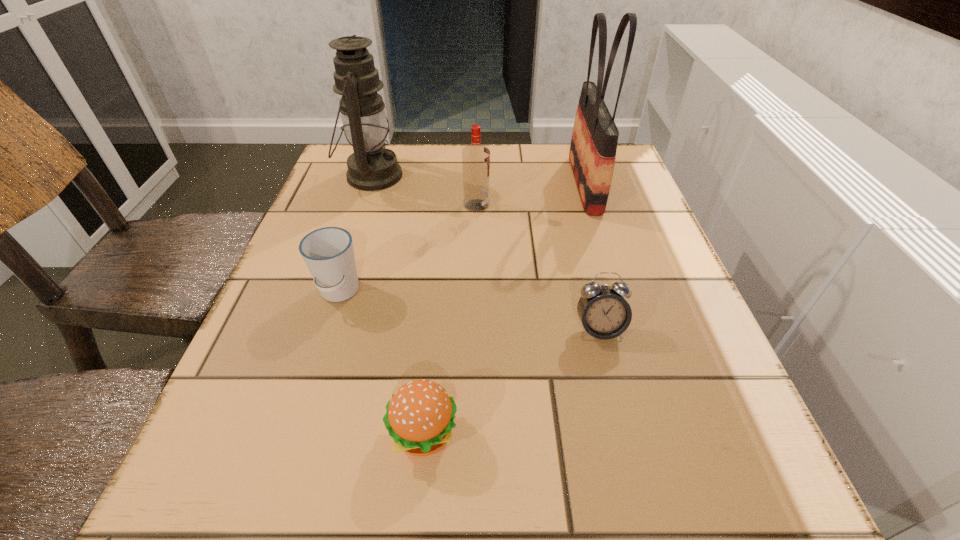
Locate an element on the screen. The image size is (960, 540). vacant space located 0.110m on the front of the oil lamp is located at coordinates (354, 229).

Find the location of a particular element. This screenshot has height=540, width=960. free space located 0.290m on the front label of the vodka is located at coordinates (615, 206).

Image resolution: width=960 pixels, height=540 pixels. I want to click on vacant space located with a handle on the side of the third nearest object, so click(x=301, y=411).

You are a GUI agent. You are given a task and a screenshot of the screen. Output one action in this format:
    pyautogui.click(x=<x>, y=<y>)
    Task: Click on the free space located 0.180m on the face of the fifth farthest object
    This screenshot has width=960, height=540.
    Given the screenshot: What is the action you would take?
    pyautogui.click(x=629, y=451)

Locate an element on the screen. This screenshot has height=540, width=960. free space located 0.210m on the back of the shortest object is located at coordinates (437, 299).

Locate an element on the screen. The height and width of the screenshot is (540, 960). shopping bag at the far edge is located at coordinates (593, 147).

Where is `oil lamp that is at the far edge`? This screenshot has width=960, height=540. oil lamp that is at the far edge is located at coordinates (372, 167).

Locate an element on the screen. object present at the near edge is located at coordinates (419, 417).

Where is `oil lamp at the left edge`? This screenshot has height=540, width=960. oil lamp at the left edge is located at coordinates (372, 167).

Where is `cup positioned at the left edge`? The width and height of the screenshot is (960, 540). cup positioned at the left edge is located at coordinates (328, 253).